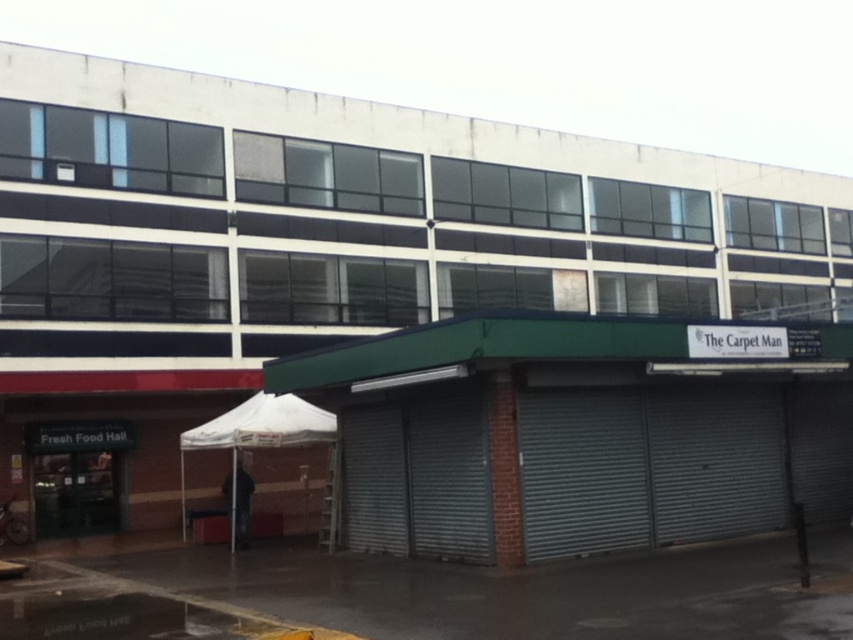
Based on the photo, is gray metallic garage door at center shorter than white fabric canopy at lower left?

In fact, gray metallic garage door at center may be taller than white fabric canopy at lower left.

Who is more distant from viewer, (x=561, y=449) or (x=326, y=419)?

Positioned behind is point (x=326, y=419).

The width and height of the screenshot is (853, 640). What do you see at coordinates (647, 467) in the screenshot? I see `gray metallic garage door at center` at bounding box center [647, 467].

The image size is (853, 640). I want to click on gray metallic garage door at center, so click(x=647, y=467).